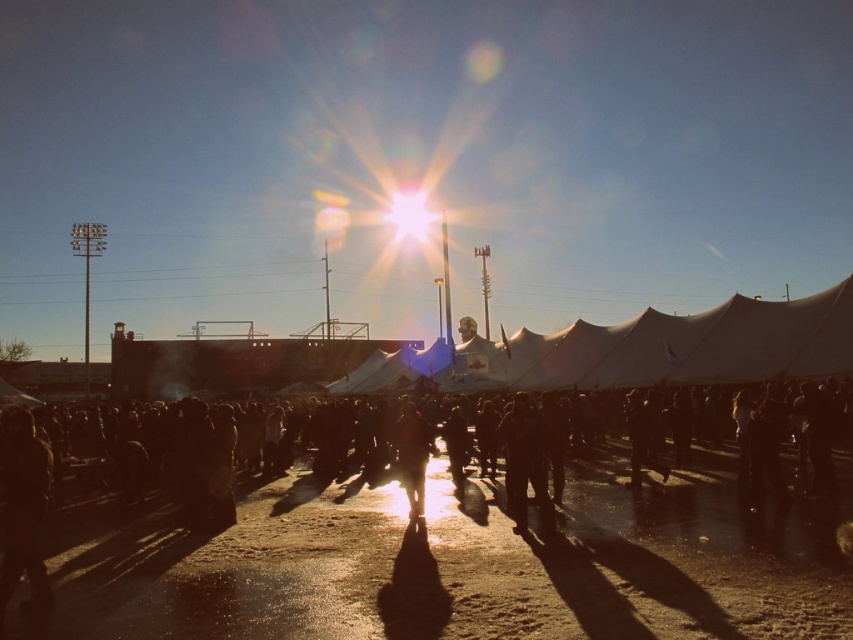
You are a photographer trying to capture a detailed shot of the dark fabric jacket at left. However, the bright sunlight is causing lens flares. Where should you position yourself relative to the sun to avoid the glare affecting your shot?

To avoid the glare from the sun affecting your shot of the dark fabric jacket at left, position yourself so the sun is behind you, facing away from the glare source.

You are a photographer trying to capture a clear image of the dark fabric jacket at left and the person holding a red umbrella at right. The camera you are using has a maximum focus range of 100 feet. Can you focus on both subjects simultaneously?

The dark fabric jacket at left and the person holding a red umbrella at right are 112.78 feet apart, which exceeds the camera maximum focus range of 100 feet. Therefore, you cannot focus on both subjects simultaneously.

You are a photographer trying to capture a clear shot of the silhouette figure at center and the dark fabric jacket at left. Given the backlighting from the sun, which object might be more challenging to photograph clearly due to its height relative to the light source?

The dark fabric jacket at left is taller than the silhouette figure at center, so it might be more challenging to photograph clearly because its height could cause more intense backlighting, making details harder to capture.